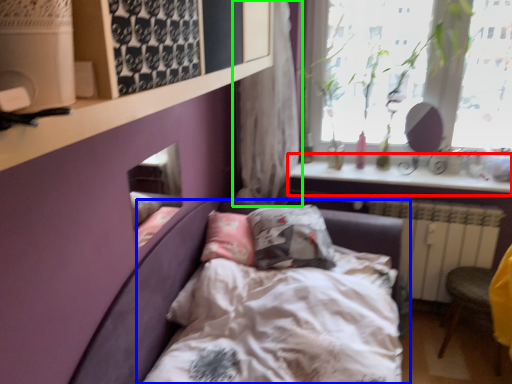
Question: Estimate the real-world distances between objects in this image. Which object is closer to window sill (highlighted by a red box), bed (highlighted by a blue box) or curtain (highlighted by a green box)?

Choices:
 (A) bed
 (B) curtain

Answer: (B)